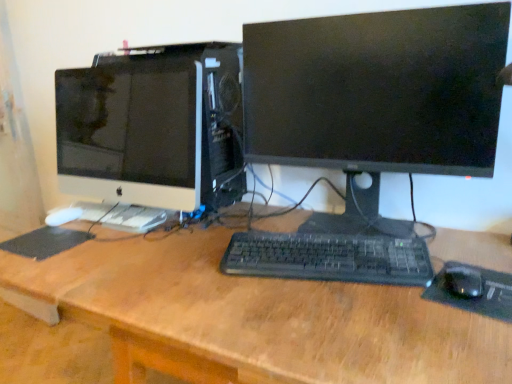
This screenshot has height=384, width=512. Identify the location of vacant area situated below black matte monitor at center, the second computer monitor from the left (from a real-world perspective). (355, 226).